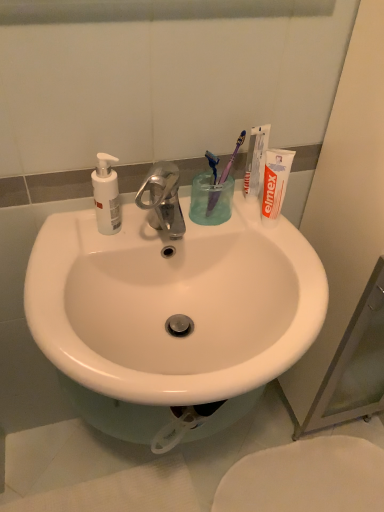
Find the location of a particular element. free location in front of white matte toothpaste tube at upper right is located at coordinates (299, 270).